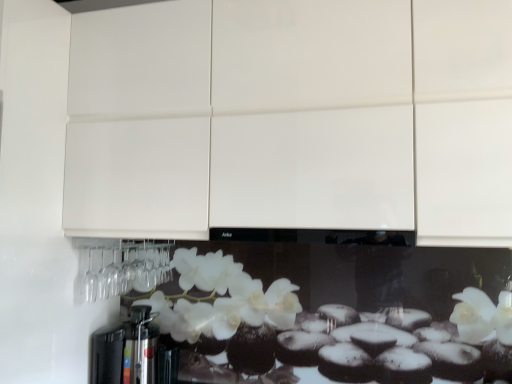
Question: From the image's perspective, is metallic silver coffee machine at lower left over white glossy cabinet at upper center?

Choices:
 (A) no
 (B) yes

Answer: (A)

Question: Does metallic silver coffee machine at lower left lie behind white glossy cabinet at upper center?

Choices:
 (A) yes
 (B) no

Answer: (A)

Question: From a real-world perspective, is metallic silver coffee machine at lower left physically below white glossy cabinet at upper center?

Choices:
 (A) no
 (B) yes

Answer: (B)

Question: From the image's perspective, would you say metallic silver coffee machine at lower left is shown under white glossy cabinet at upper center?

Choices:
 (A) yes
 (B) no

Answer: (A)

Question: Considering the relative positions of metallic silver coffee machine at lower left and white glossy cabinet at upper center in the image provided, is metallic silver coffee machine at lower left to the left of white glossy cabinet at upper center from the viewer's perspective?

Choices:
 (A) no
 (B) yes

Answer: (B)

Question: Is white glossy cabinet at upper center a part of metallic silver coffee machine at lower left?

Choices:
 (A) yes
 (B) no

Answer: (B)

Question: Would you consider white glossy cabinet at upper center to be distant from metallic silver coffee machine at lower left?

Choices:
 (A) yes
 (B) no

Answer: (B)

Question: Does white glossy cabinet at upper center turn towards metallic silver coffee machine at lower left?

Choices:
 (A) no
 (B) yes

Answer: (A)

Question: Is white glossy cabinet at upper center wider than metallic silver coffee machine at lower left?

Choices:
 (A) no
 (B) yes

Answer: (B)

Question: Considering the relative positions of white glossy cabinet at upper center and metallic silver coffee machine at lower left in the image provided, is white glossy cabinet at upper center in front of metallic silver coffee machine at lower left?

Choices:
 (A) no
 (B) yes

Answer: (B)

Question: From a real-world perspective, is white glossy cabinet at upper center over metallic silver coffee machine at lower left?

Choices:
 (A) no
 (B) yes

Answer: (B)

Question: Is white glossy cabinet at upper center at the right side of metallic silver coffee machine at lower left?

Choices:
 (A) no
 (B) yes

Answer: (B)

Question: From a real-world perspective, relative to white glossy cabinet at upper center, is metallic silver coffee machine at lower left vertically above or below?

Choices:
 (A) below
 (B) above

Answer: (A)